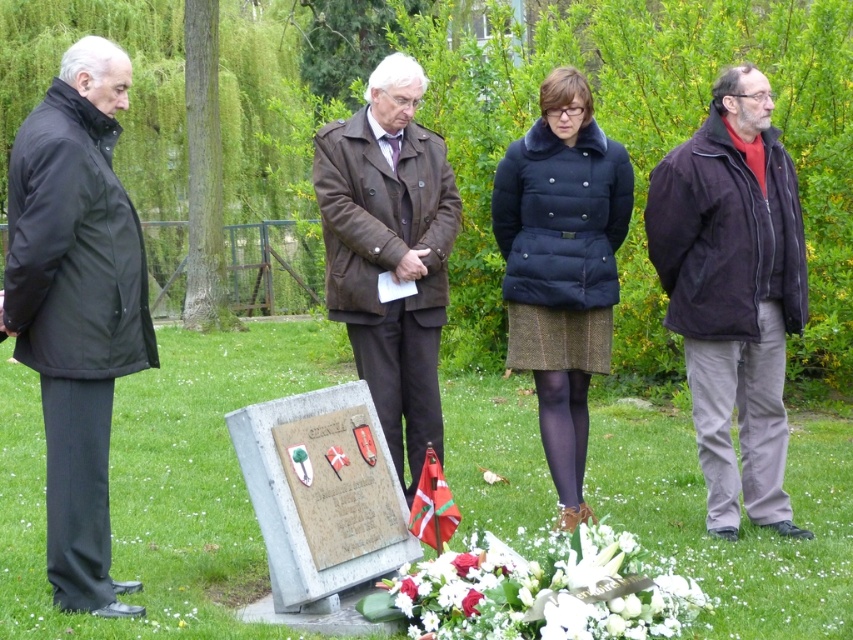
Question: Among these points, which one is nearest to the camera?

Choices:
 (A) (395, 228)
 (B) (73, 211)

Answer: (B)

Question: Considering the relative positions of brown leather coat at center and white floral bouquet at lower center in the image provided, where is brown leather coat at center located with respect to white floral bouquet at lower center?

Choices:
 (A) right
 (B) left

Answer: (B)

Question: Does dark brown jacket at right come behind brown leather coat at center?

Choices:
 (A) yes
 (B) no

Answer: (A)

Question: Which point is closer to the camera?

Choices:
 (A) (672, 237)
 (B) (480, 628)
 (C) (90, 387)

Answer: (B)

Question: Among these points, which one is farthest from the camera?

Choices:
 (A) (553, 288)
 (B) (547, 548)

Answer: (A)

Question: Is black matte jacket at left behind dark brown jacket at right?

Choices:
 (A) yes
 (B) no

Answer: (B)